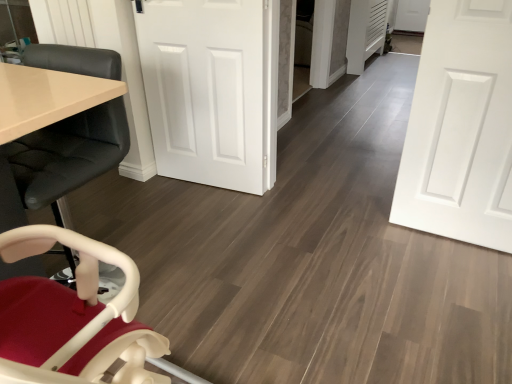
What are the coordinates of `vacant area situated below white smooth door at center, marked as the 2th door in a right-to-left arrangement (from a real-world perspective)` in the screenshot? It's located at (216, 185).